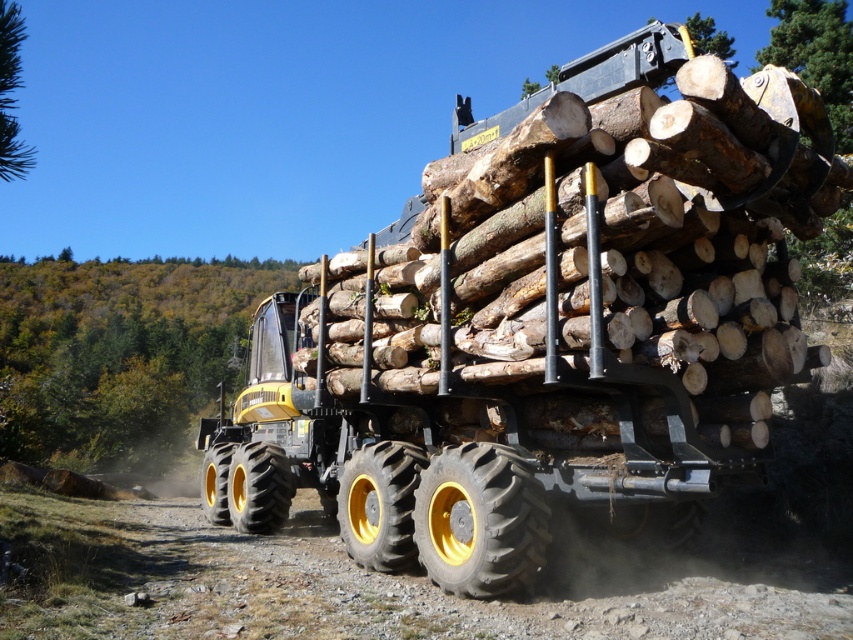
Between yellow metallic tractor at center and rubber/yellow rimmed tire at lower center, which one is positioned lower?

Positioned lower is yellow metallic tractor at center.

At what (x,y) coordinates should I click in order to perform the action: click on yellow metallic tractor at center. Please return your answer as a coordinate pair (x, y). Looking at the image, I should click on (262, 435).

Between point (328, 461) and point (368, 508), which one is positioned behind?

The point (328, 461) is more distant.

This screenshot has width=853, height=640. Identify the location of yellow metallic tractor at center. (262, 435).

Does dusty gravel dirt track at lower center appear on the left side of yellow rubber tire at lower center?

Indeed, dusty gravel dirt track at lower center is positioned on the left side of yellow rubber tire at lower center.

Between point (345, 602) and point (457, 477), which one is positioned in front?

Point (345, 602) is in front.

Who is more distant from viewer, (695, 612) or (511, 484)?

The point (511, 484) is behind.

Locate an element on the screen. The height and width of the screenshot is (640, 853). dusty gravel dirt track at lower center is located at coordinates (451, 595).

This screenshot has width=853, height=640. What do you see at coordinates (262, 435) in the screenshot? I see `yellow metallic tractor at center` at bounding box center [262, 435].

Is point (259, 384) farther from camera compared to point (15, 141)?

Yes, point (259, 384) is behind point (15, 141).

At what (x,y) coordinates should I click in order to perform the action: click on yellow metallic tractor at center. Please return your answer as a coordinate pair (x, y). The image size is (853, 640). Looking at the image, I should click on (262, 435).